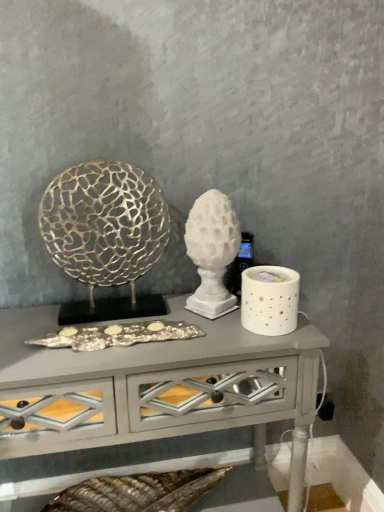
Question: From the image's perspective, is white glossy table at center located above or below white matte sculpture at center, placed as the first sculpture when sorted from right to left?

Choices:
 (A) below
 (B) above

Answer: (A)

Question: Based on their positions, is white glossy table at center located to the left or right of white matte sculpture at center, which ranks as the 2th sculpture in left-to-right order?

Choices:
 (A) right
 (B) left

Answer: (B)

Question: Which is farther from the white ceramic candle holder at right?

Choices:
 (A) white matte sculpture at center, placed as the first sculpture when sorted from right to left
 (B) white glossy table at center
 (C) gold textured sculpture at left, the 1th sculpture positioned from the left

Answer: (C)

Question: Estimate the real-world distances between objects in this image. Which object is closer to the gold textured sculpture at left, which ranks as the second sculpture in right-to-left order?

Choices:
 (A) white matte sculpture at center, which ranks as the 2th sculpture in left-to-right order
 (B) white ceramic candle holder at right
 (C) white glossy table at center

Answer: (A)